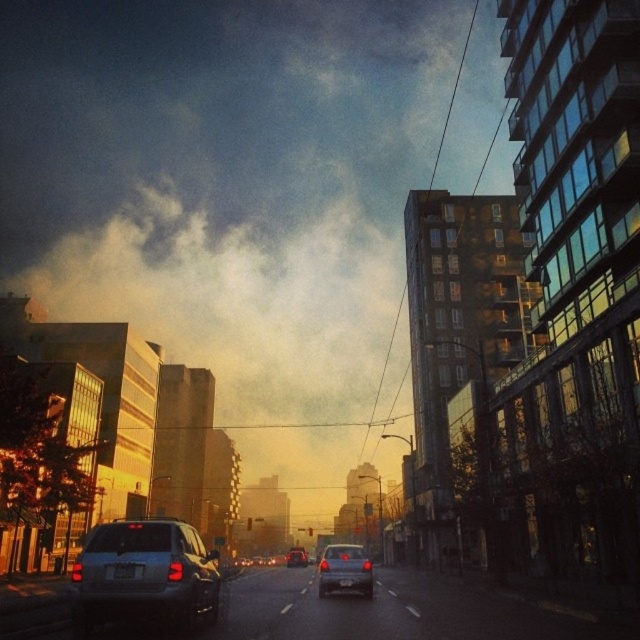
Question: Which object appears closest to the camera in this image?

Choices:
 (A) satin silver sedan at center
 (B) smokey haze at upper center

Answer: (A)

Question: Which object is positioned closest to the satin silver sedan at center?

Choices:
 (A) shiny silver sedan at center
 (B) satin silver suv at center
 (C) smokey haze at upper center

Answer: (B)

Question: Can you confirm if smokey haze at upper center is positioned to the left of satin silver suv at center?

Choices:
 (A) no
 (B) yes

Answer: (B)

Question: Considering the relative positions of smokey haze at upper center and shiny silver sedan at center in the image provided, where is smokey haze at upper center located with respect to shiny silver sedan at center?

Choices:
 (A) left
 (B) right

Answer: (A)

Question: Can you confirm if satin silver suv at center is wider than shiny silver sedan at center?

Choices:
 (A) yes
 (B) no

Answer: (B)

Question: Considering the real-world distances, which object is farthest from the satin silver suv at center?

Choices:
 (A) shiny silver sedan at center
 (B) smokey haze at upper center

Answer: (B)